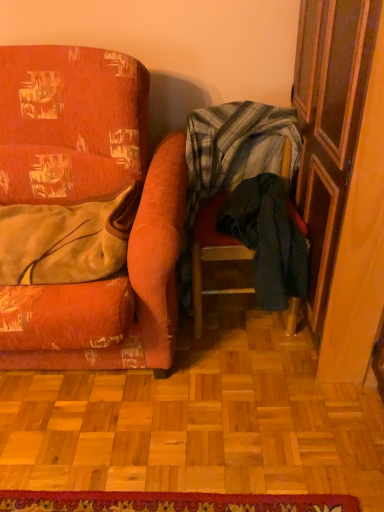
Identify the location of plaid fabric chair at center, acting as the 1th chair starting from the right. (228, 181).

This screenshot has height=512, width=384. Describe the element at coordinates (170, 502) in the screenshot. I see `red woven mat at lower center` at that location.

The image size is (384, 512). I want to click on velvet-like beige blanket at left, which appears as the first clothing when viewed from the left, so click(x=66, y=239).

Where is `wooden screen door at right`? wooden screen door at right is located at coordinates (342, 176).

From the image's perspective, count 2nd clothings downward from the distressed orange fabric chair at left, the first chair viewed from the left, and point to it. Please provide its 2D coordinates.

[(268, 239)]

Is distressed orange fabric chair at left, the first chair viewed from the left, at the back of dark green fabric at lower right, positioned as the 1th clothing in right-to-left order?

No, dark green fabric at lower right, positioned as the 1th clothing in right-to-left order,'s orientation is not away from distressed orange fabric chair at left, the first chair viewed from the left.

Is point (300, 251) closer or farther from the camera than point (2, 368)?

Point (300, 251).

From the image's perspective, between dark green fabric at lower right, positioned as the 1th clothing in right-to-left order, and distressed orange fabric chair at left, the first chair viewed from the left, which one is located above?

distressed orange fabric chair at left, the first chair viewed from the left, appears higher in the image.

Is the surface of plaid fabric chair at center, acting as the 1th chair starting from the right, in direct contact with dark green fabric at lower right, the 2th clothing when ordered from left to right?

No, plaid fabric chair at center, acting as the 1th chair starting from the right, is not with dark green fabric at lower right, the 2th clothing when ordered from left to right.

Starting from the dark green fabric at lower right, positioned as the 1th clothing in right-to-left order, which chair is the 1st one in front? Please provide its 2D coordinates.

[(228, 181)]

From the image's perspective, is plaid fabric chair at center, acting as the 1th chair starting from the right, located above or below dark green fabric at lower right, the 2th clothing when ordered from left to right?

From the image's perspective, plaid fabric chair at center, acting as the 1th chair starting from the right, appears above dark green fabric at lower right, the 2th clothing when ordered from left to right.

Which object is further away from the camera taking this photo, plaid fabric chair at center, acting as the 1th chair starting from the right, or dark green fabric at lower right, positioned as the 1th clothing in right-to-left order?

dark green fabric at lower right, positioned as the 1th clothing in right-to-left order.

From a real-world perspective, is velvet-like beige blanket at left, which appears as the first clothing when viewed from the left, positioned above or below distressed orange fabric chair at left, the first chair viewed from the left?

velvet-like beige blanket at left, which appears as the first clothing when viewed from the left, is situated higher than distressed orange fabric chair at left, the first chair viewed from the left, in the real world.

Measure the distance between velvet-like beige blanket at left, which appears as the first clothing when viewed from the left, and distressed orange fabric chair at left, the first chair viewed from the left.

They are 7.18 inches apart.

Between velvet-like beige blanket at left, which appears as the first clothing when viewed from the left, and distressed orange fabric chair at left, the first chair viewed from the left, which one has more height?

With more height is distressed orange fabric chair at left, the first chair viewed from the left.

Consider the image. Which is more to the left, velvet-like beige blanket at left, which appears as the first clothing when viewed from the left, or distressed orange fabric chair at left, the first chair viewed from the left?

Positioned to the left is distressed orange fabric chair at left, the first chair viewed from the left.

Who is bigger, plaid fabric chair at center, the second chair from the left, or red woven mat at lower center?

With larger size is plaid fabric chair at center, the second chair from the left.

Is plaid fabric chair at center, acting as the 1th chair starting from the right, positioned behind red woven mat at lower center?

Yes, it is.

At what (x,y) coordinates should I click in order to perform the action: click on doormat below the plaid fabric chair at center, acting as the 1th chair starting from the right (from the image's perspective). Please return your answer as a coordinate pair (x, y). This screenshot has height=512, width=384. Looking at the image, I should click on (170, 502).

Is plaid fabric chair at center, the second chair from the left, at the left side of red woven mat at lower center?

No.

From the picture: Considering the positions of objects red woven mat at lower center and plaid fabric chair at center, acting as the 1th chair starting from the right, in the image provided, who is more to the right, red woven mat at lower center or plaid fabric chair at center, acting as the 1th chair starting from the right,?

plaid fabric chair at center, acting as the 1th chair starting from the right, is more to the right.

Is red woven mat at lower center completely or partially outside of plaid fabric chair at center, acting as the 1th chair starting from the right?

Indeed, red woven mat at lower center is completely outside plaid fabric chair at center, acting as the 1th chair starting from the right.

From the picture: Is red woven mat at lower center oriented away from plaid fabric chair at center, acting as the 1th chair starting from the right?

red woven mat at lower center does not have its back to plaid fabric chair at center, acting as the 1th chair starting from the right.

From the image's perspective, is red woven mat at lower center above or below plaid fabric chair at center, the second chair from the left?

red woven mat at lower center is situated lower than plaid fabric chair at center, the second chair from the left, in the image.

Considering the sizes of red woven mat at lower center and velvet-like beige blanket at left, the second clothing positioned from the right, in the image, is red woven mat at lower center bigger or smaller than velvet-like beige blanket at left, the second clothing positioned from the right,?

Clearly, red woven mat at lower center is smaller in size than velvet-like beige blanket at left, the second clothing positioned from the right.

In the scene shown: Is red woven mat at lower center situated inside velvet-like beige blanket at left, which appears as the first clothing when viewed from the left, or outside?

red woven mat at lower center lies outside velvet-like beige blanket at left, which appears as the first clothing when viewed from the left.

Measure the distance from red woven mat at lower center to velvet-like beige blanket at left, which appears as the first clothing when viewed from the left.

red woven mat at lower center and velvet-like beige blanket at left, which appears as the first clothing when viewed from the left, are 31.34 inches apart.

Is there a large distance between distressed orange fabric chair at left, the first chair viewed from the left, and red woven mat at lower center?

That's not correct — distressed orange fabric chair at left, the first chair viewed from the left, is a little close to red woven mat at lower center.

From the image's perspective, which chair is the 2nd one above the red woven mat at lower center? Please provide its 2D coordinates.

[(87, 199)]

From the image's perspective, which is above, distressed orange fabric chair at left, the first chair viewed from the left, or red woven mat at lower center?

distressed orange fabric chair at left, the first chair viewed from the left, is shown above in the image.

Looking at this image, between distressed orange fabric chair at left, the first chair viewed from the left, and red woven mat at lower center, which one is positioned behind?

red woven mat at lower center is more distant.

At what (x,y) coordinates should I click in order to perform the action: click on clothing that is the 2nd one when counting rightward from the distressed orange fabric chair at left, the second chair from the right. Please return your answer as a coordinate pair (x, y). The width and height of the screenshot is (384, 512). Looking at the image, I should click on (268, 239).

The image size is (384, 512). In order to click on the 1st chair to the left when counting from the dark green fabric at lower right, the 2th clothing when ordered from left to right in this screenshot , I will do `click(228, 181)`.

Based on their spatial positions, is dark green fabric at lower right, the 2th clothing when ordered from left to right, or wooden screen door at right closer to velvet-like beige blanket at left, the second clothing positioned from the right?

Based on the image, dark green fabric at lower right, the 2th clothing when ordered from left to right, appears to be nearer to velvet-like beige blanket at left, the second clothing positioned from the right.

Estimate the real-world distances between objects in this image. Which object is further from velvet-like beige blanket at left, which appears as the first clothing when viewed from the left, wooden screen door at right or distressed orange fabric chair at left, the first chair viewed from the left?

The object further to velvet-like beige blanket at left, which appears as the first clothing when viewed from the left, is wooden screen door at right.

Looking at the image, which one is located closer to velvet-like beige blanket at left, which appears as the first clothing when viewed from the left, wooden screen door at right or red woven mat at lower center?

wooden screen door at right lies closer to velvet-like beige blanket at left, which appears as the first clothing when viewed from the left, than the other object.

Which object lies nearer to the anchor point dark green fabric at lower right, the 2th clothing when ordered from left to right, red woven mat at lower center or wooden screen door at right?

wooden screen door at right lies closer to dark green fabric at lower right, the 2th clothing when ordered from left to right, than the other object.

From the image, which object appears to be farther from wooden screen door at right, plaid fabric chair at center, the second chair from the left, or dark green fabric at lower right, positioned as the 1th clothing in right-to-left order?

Based on the image, plaid fabric chair at center, the second chair from the left, appears to be further to wooden screen door at right.

From the image, which object appears to be farther from red woven mat at lower center, velvet-like beige blanket at left, which appears as the first clothing when viewed from the left, or plaid fabric chair at center, acting as the 1th chair starting from the right?

The object further to red woven mat at lower center is plaid fabric chair at center, acting as the 1th chair starting from the right.

Based on their spatial positions, is velvet-like beige blanket at left, the second clothing positioned from the right, or plaid fabric chair at center, acting as the 1th chair starting from the right, closer to distressed orange fabric chair at left, the second chair from the right?

Among the two, velvet-like beige blanket at left, the second clothing positioned from the right, is located nearer to distressed orange fabric chair at left, the second chair from the right.

When comparing their distances from plaid fabric chair at center, the second chair from the left, does red woven mat at lower center or wooden screen door at right seem further?

red woven mat at lower center lies further to plaid fabric chair at center, the second chair from the left, than the other object.

Image resolution: width=384 pixels, height=512 pixels. Identify the location of clothing between distressed orange fabric chair at left, the second chair from the right, and plaid fabric chair at center, acting as the 1th chair starting from the right, in the horizontal direction. (66, 239).

You are a GUI agent. You are given a task and a screenshot of the screen. Output one action in this format:
    pyautogui.click(x=<x>, y=<y>)
    Task: Click on the chair situated between distressed orange fabric chair at left, the second chair from the right, and dark green fabric at lower right, positioned as the 1th clothing in right-to-left order, from left to right
    The width and height of the screenshot is (384, 512).
    Given the screenshot: What is the action you would take?
    pyautogui.click(x=228, y=181)

This screenshot has width=384, height=512. Find the location of `clothing between velvet-like beige blanket at left, the second clothing positioned from the right, and wooden screen door at right`. clothing between velvet-like beige blanket at left, the second clothing positioned from the right, and wooden screen door at right is located at coordinates (268, 239).

Locate an element on the screen. The image size is (384, 512). clothing between velvet-like beige blanket at left, which appears as the first clothing when viewed from the left, and red woven mat at lower center vertically is located at coordinates (268, 239).